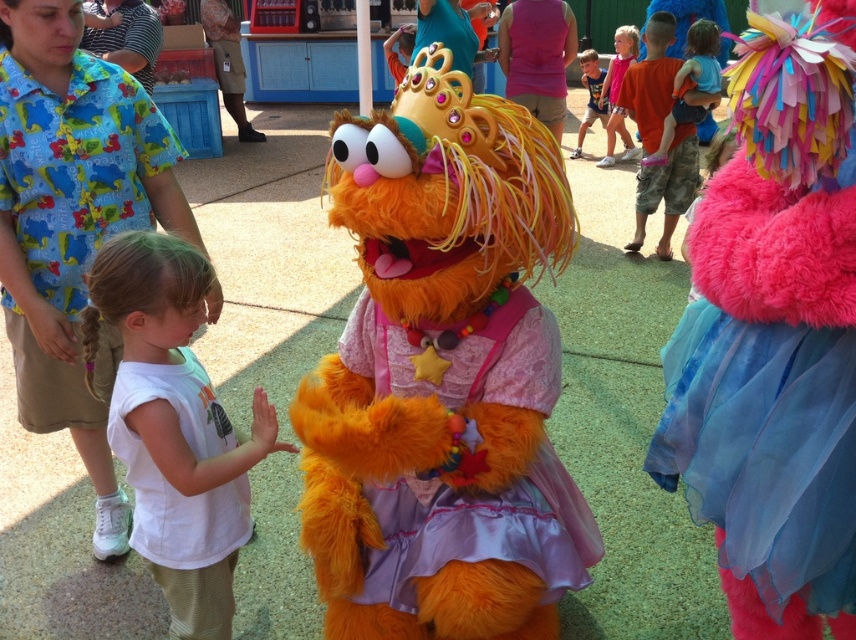
Question: Is fluffy orange fur at center positioned at the back of orange furry costume at left?

Choices:
 (A) no
 (B) yes

Answer: (A)

Question: Is white cotton shirt at center bigger than orange furry costume at left?

Choices:
 (A) yes
 (B) no

Answer: (A)

Question: Which object appears closest to the camera in this image?

Choices:
 (A) fluffy orange fur at center
 (B) blue fabric shirt at upper right
 (C) orange furry costume at left

Answer: (A)

Question: Can you confirm if orange furry costume at left is positioned to the right of blue fabric shirt at upper right?

Choices:
 (A) yes
 (B) no

Answer: (B)

Question: Which of the following is the farthest from the observer?

Choices:
 (A) (58, 362)
 (B) (663, 161)

Answer: (B)

Question: Which is nearer to the fluffy orange fur at center?

Choices:
 (A) white cotton shirt at center
 (B) orange furry costume at left
 (C) blue fabric shirt at upper right

Answer: (A)